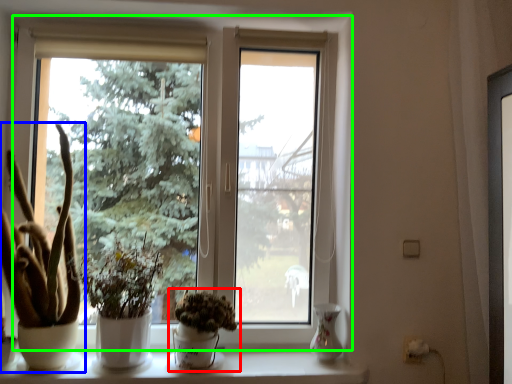
Question: Which object is the closest to the houseplant (highlighted by a red box)? Choose among these: houseplant (highlighted by a blue box) or window (highlighted by a green box).

Choices:
 (A) houseplant
 (B) window

Answer: (B)